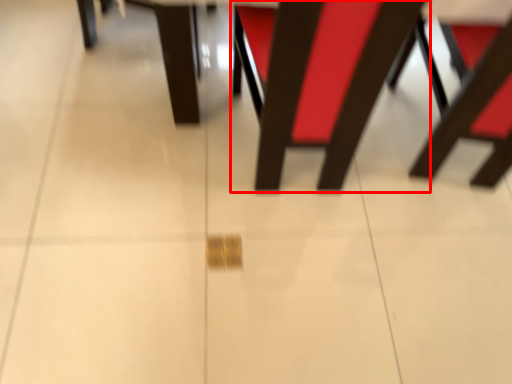
Question: In this image, where is chair (annotated by the red box) located relative to chair?

Choices:
 (A) left
 (B) right

Answer: (A)